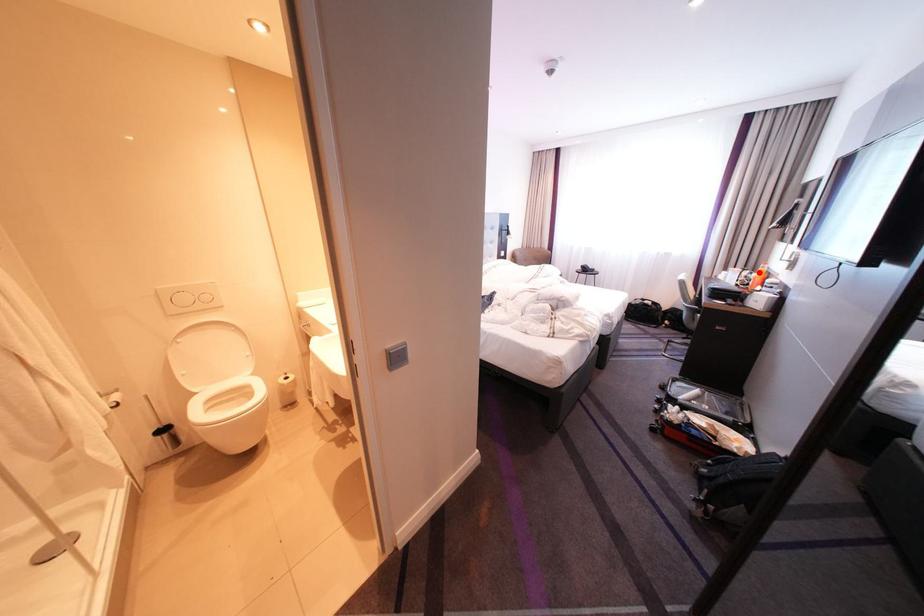
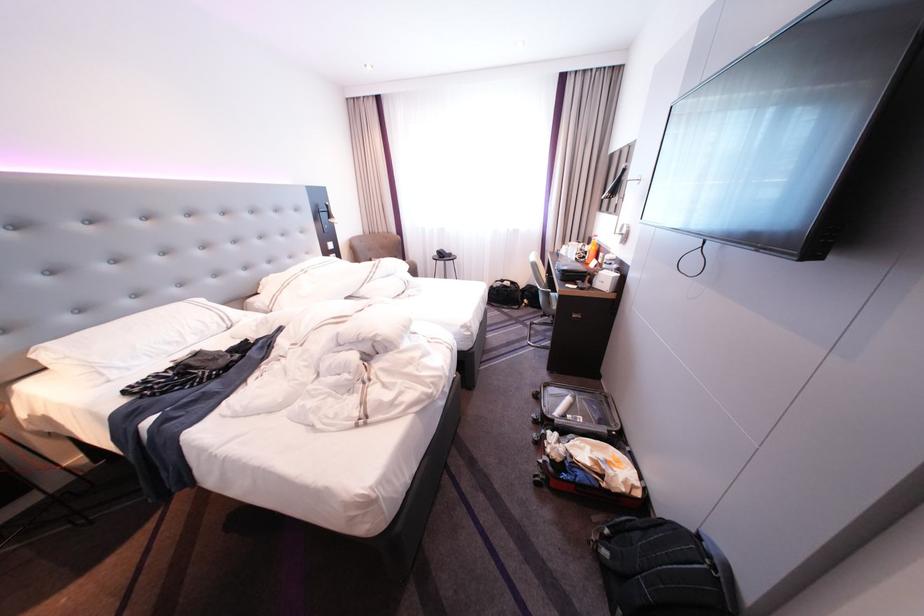
Question: I am providing you with two images of the same scene from different viewpoints. A red point is marked on the first image. Is the red point's position out of view in image 2?

Choices:
 (A) Yes
 (B) No

Answer: (B)